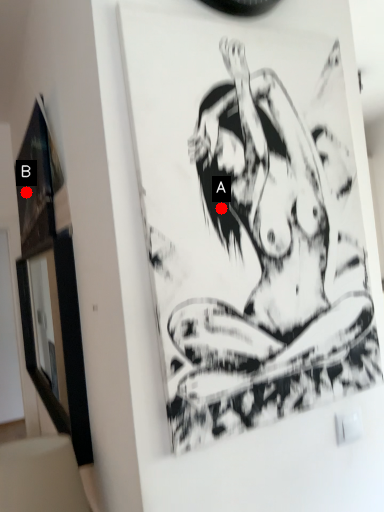
Question: Two points are circled on the image, labeled by A and B beside each circle. Which point is farther to the camera?

Choices:
 (A) A is further
 (B) B is further

Answer: (B)